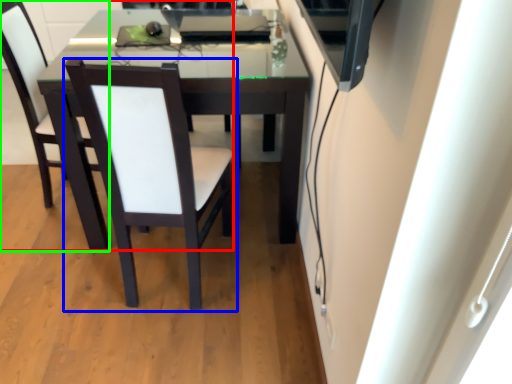
Question: Considering the real-world distances, which object is closest to chair (highlighted by a red box)? chair (highlighted by a blue box) or chair (highlighted by a green box).

Choices:
 (A) chair
 (B) chair

Answer: (B)